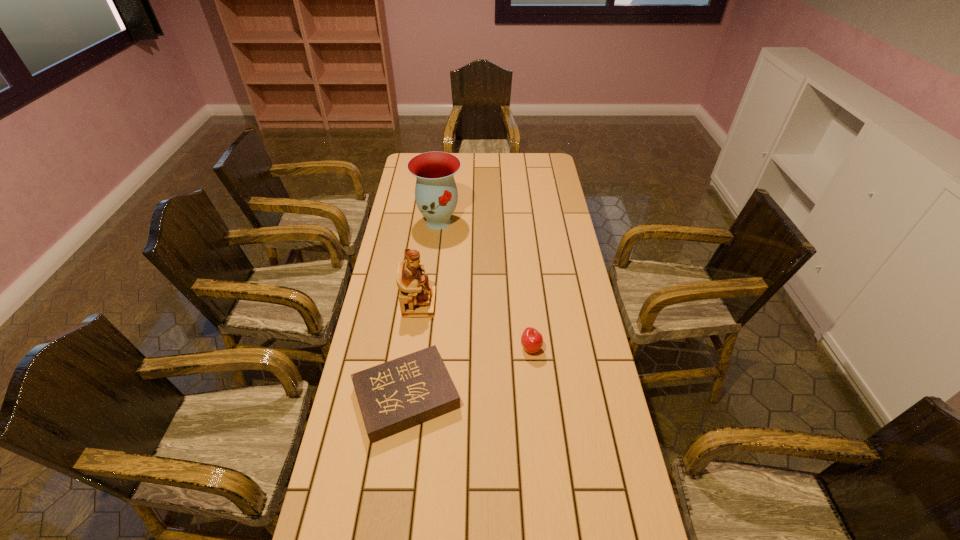
Locate an element on the screen. The height and width of the screenshot is (540, 960). the farthest object is located at coordinates (436, 195).

The image size is (960, 540). I want to click on the second farthest object, so click(417, 298).

At what (x,y) coordinates should I click in order to perform the action: click on apple. Please return your answer as a coordinate pair (x, y). This screenshot has width=960, height=540. Looking at the image, I should click on (531, 340).

Locate an element on the screen. The image size is (960, 540). the third tallest object is located at coordinates (531, 340).

I want to click on the shortest object, so click(x=394, y=396).

Identify the location of vacant space positioned 0.400m on the right of the vase. (556, 222).

Identify the location of free space located 0.180m on the front-facing side of the figurine. Image resolution: width=960 pixels, height=540 pixels. (487, 304).

What are the coordinates of `free space located on the right of the third tallest object` in the screenshot? It's located at (595, 348).

The width and height of the screenshot is (960, 540). Identify the location of vacant space located on the right of the hardback book. (495, 396).

What are the coordinates of `vase located in the left edge section of the desktop` in the screenshot? It's located at (436, 195).